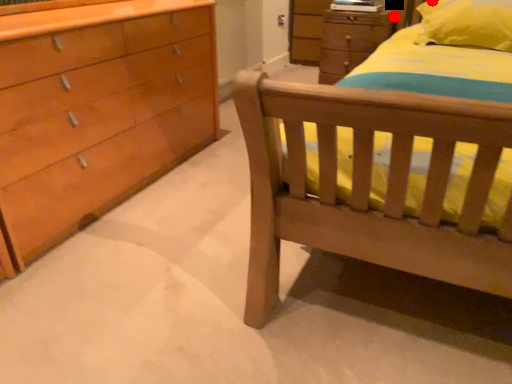
Question: Two points are circled on the image, labeled by A and B beside each circle. Among these points, which one is nearest to the camera?

Choices:
 (A) A is closer
 (B) B is closer

Answer: (B)